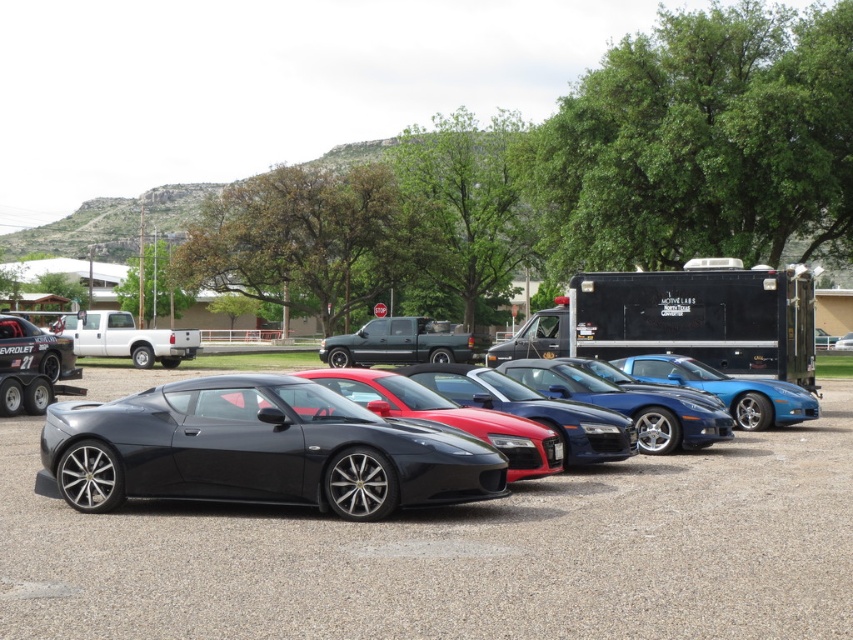
You are a delivery driver needing to park your truck between the glossy black car at center and the glossy blue car at center. Your truck is 10 meters long. Can you fit your truck between them without overlapping either car?

The glossy black car at center and glossy blue car at center are 52.57 meters apart from each other. Since your truck is 10 meters long, there is sufficient space between them to park without overlapping either car.

Based on the photo, you are standing at the center of the parking lot and want to locate the black matte trailer at center. According to the coordinates provided, where exactly should you look?

The black matte trailer at center is located at the coordinates point (699, 317).

You are a photographer wanting to capture the glossy black sports car at center without the black matte trailer at center appearing in the frame. Based on their positions, is this possible?

The black matte trailer at center is located above the glossy black sports car at center, so adjusting the camera angle downward might allow you to exclude the trailer from the frame while keeping the sports car visible.